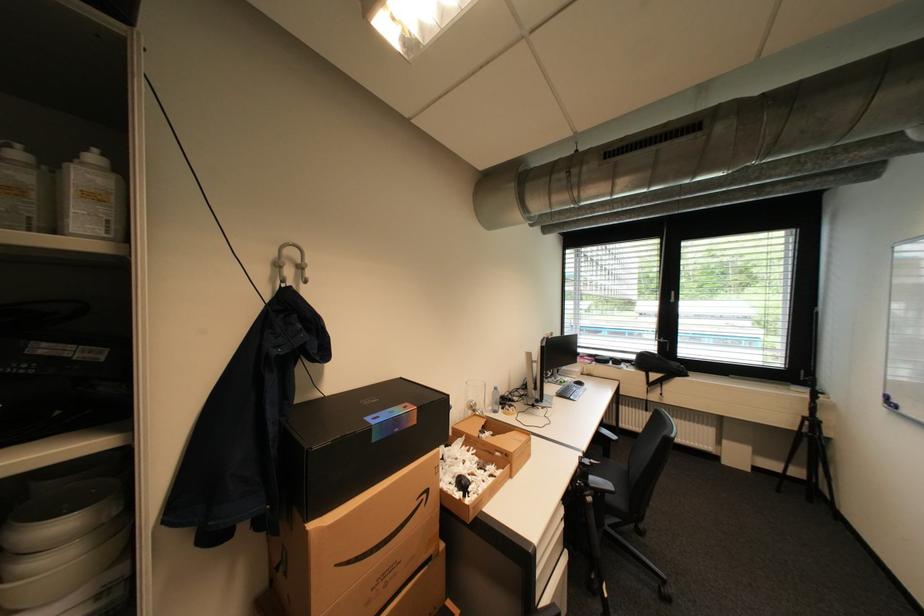
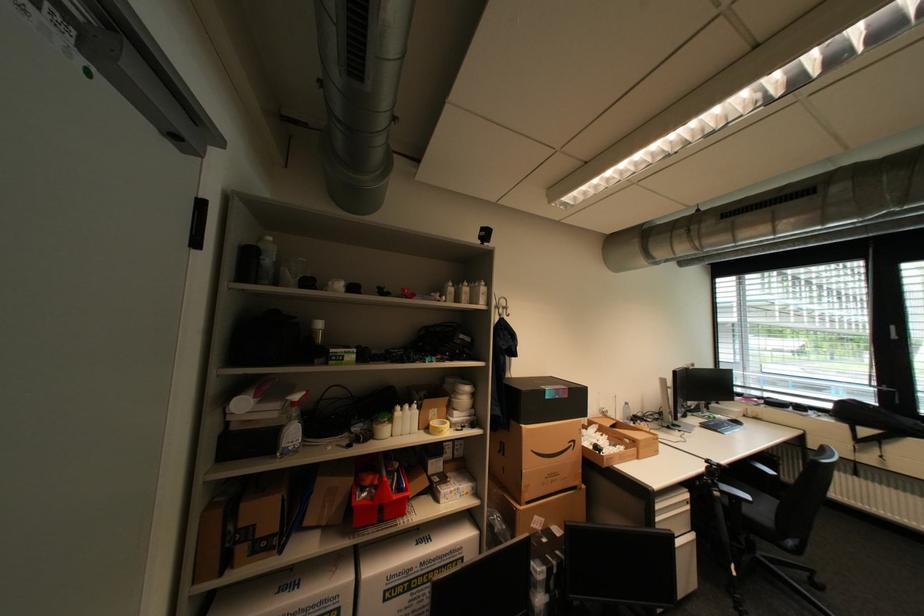
Question: The camera is either moving clockwise (left) or counter-clockwise (right) around the object. The first image is from the beginning of the video and the second image is from the end. Is the camera moving left or right when shooting the video?

Choices:
 (A) Left
 (B) Right

Answer: (B)